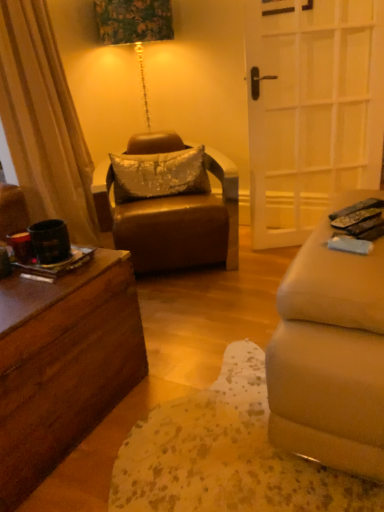
Locate an element on the screen. The width and height of the screenshot is (384, 512). white glass door at right is located at coordinates (311, 109).

You are a GUI agent. You are given a task and a screenshot of the screen. Output one action in this format:
    pyautogui.click(x=<x>, y=<y>)
    Task: Click on the black plastic remote control at lower right
    
    Given the screenshot: What is the action you would take?
    pyautogui.click(x=358, y=208)

How many degrees apart are the facing directions of white glass door at right and silver sequined pillow at center?

The angular difference between white glass door at right and silver sequined pillow at center is 3.21 degrees.

Is white glass door at right at the right side of silver sequined pillow at center?

Correct, you'll find white glass door at right to the right of silver sequined pillow at center.

Is white glass door at right oriented away from silver sequined pillow at center?

No, silver sequined pillow at center is not at the back of white glass door at right.

Considering the relative sizes of white glass door at right and silver sequined pillow at center in the image provided, is white glass door at right smaller than silver sequined pillow at center?

Actually, white glass door at right might be larger than silver sequined pillow at center.

Is white glass door at right at the back of black plastic remote control at lower right?

No, black plastic remote control at lower right is not facing the opposite direction of white glass door at right.

Is black plastic remote control at lower right completely or partially outside of white glass door at right?

Yes, black plastic remote control at lower right is located beyond the bounds of white glass door at right.

Find the location of a particular element. The width and height of the screenshot is (384, 512). remote control beneath the white glass door at right (from a real-world perspective) is located at coordinates (358, 208).

Is black plastic remote control at lower right positioned in front of white glass door at right?

Yes, it is in front of white glass door at right.

From the image's perspective, is black plastic remote control at lower right positioned above or below leather at center?

black plastic remote control at lower right is situated lower than leather at center in the image.

Choose the correct answer: Is black plastic remote control at lower right inside leather at center or outside it?

black plastic remote control at lower right cannot be found inside leather at center.

From a real-world perspective, between black plastic remote control at lower right and leather at center, who is vertically higher?

In real-world perspective, black plastic remote control at lower right is above.

From the picture: Considering the relative positions of black plastic remote control at lower right and leather at center in the image provided, is black plastic remote control at lower right to the right of leather at center from the viewer's perspective?

Yes.

Does point (162, 182) come closer to viewer compared to point (353, 128)?

Yes, point (162, 182) is in front of point (353, 128).

Does silver sequined pillow at center appear on the left side of white glass door at right?

Yes, silver sequined pillow at center is to the left of white glass door at right.

Is silver sequined pillow at center positioned before white glass door at right?

No, it is not.

Is silver sequined pillow at center shorter than white glass door at right?

Yes, silver sequined pillow at center is shorter than white glass door at right.

Is point (109, 194) farther from viewer compared to point (270, 118)?

Yes.

Is leather at center not near white glass door at right?

They are positioned close to each other.

Is leather at center positioned beyond the bounds of white glass door at right?

Absolutely, leather at center is external to white glass door at right.

Which object is closer to the camera taking this photo, leather at center or white glass door at right?

leather at center is in front.

From the image's perspective, is leather at center located beneath black plastic remote control at lower right?

No, from the image's perspective, leather at center is not below black plastic remote control at lower right.

Based on the photo, in terms of width, does leather at center look wider or thinner when compared to black plastic remote control at lower right?

leather at center is wider than black plastic remote control at lower right.

Considering the points (175, 199) and (370, 200), which point is in front, point (175, 199) or point (370, 200)?

Point (370, 200)

Considering the relative sizes of silver sequined pillow at center and leather at center in the image provided, is silver sequined pillow at center bigger than leather at center?

No.

Which object is further away from the camera, silver sequined pillow at center or leather at center?

Positioned behind is silver sequined pillow at center.

Which object is positioned more to the left, silver sequined pillow at center or leather at center?

silver sequined pillow at center.

Is silver sequined pillow at center looking in the opposite direction of leather at center?

Yes, silver sequined pillow at center is positioned with its back facing leather at center.

Where is `door above the silver sequined pillow at center (from the image's perspective)`? door above the silver sequined pillow at center (from the image's perspective) is located at coordinates (311, 109).

Image resolution: width=384 pixels, height=512 pixels. In order to click on door above the black plastic remote control at lower right (from a real-world perspective) in this screenshot , I will do point(311,109).

Estimate the real-world distances between objects in this image. Which object is closer to leather at center, silver sequined pillow at center or white glass door at right?

silver sequined pillow at center is closer to leather at center.

From the image, which object appears to be nearer to silver sequined pillow at center, white glass door at right or black plastic remote control at lower right?

Among the two, white glass door at right is located nearer to silver sequined pillow at center.

Consider the image. When comparing their distances from white glass door at right, does silver sequined pillow at center or leather at center seem closer?

leather at center lies closer to white glass door at right than the other object.

Considering their positions, is black plastic remote control at lower right positioned further to silver sequined pillow at center than white glass door at right?

black plastic remote control at lower right is positioned further to the anchor silver sequined pillow at center.

From the picture: Based on their spatial positions, is white glass door at right or leather at center further from black plastic remote control at lower right?

Among the two, white glass door at right is located further to black plastic remote control at lower right.

Based on the photo, which object lies nearer to the anchor point leather at center, silver sequined pillow at center or black plastic remote control at lower right?

silver sequined pillow at center lies closer to leather at center than the other object.

When comparing their distances from black plastic remote control at lower right, does silver sequined pillow at center or white glass door at right seem further?

silver sequined pillow at center is positioned further to the anchor black plastic remote control at lower right.

Which object lies nearer to the anchor point leather at center, black plastic remote control at lower right or silver sequined pillow at center?

silver sequined pillow at center is closer to leather at center.

This screenshot has width=384, height=512. Find the location of `remote control between leather at center and white glass door at right from left to right`. remote control between leather at center and white glass door at right from left to right is located at coordinates (358, 208).

At what (x,y) coordinates should I click in order to perform the action: click on remote control located between silver sequined pillow at center and white glass door at right in the left-right direction. Please return your answer as a coordinate pair (x, y). Image resolution: width=384 pixels, height=512 pixels. Looking at the image, I should click on (358, 208).

The image size is (384, 512). In order to click on chair between black plastic remote control at lower right and silver sequined pillow at center along the z-axis in this screenshot , I will do `click(174, 222)`.

Locate an element on the screen. The width and height of the screenshot is (384, 512). chair between silver sequined pillow at center and white glass door at right is located at coordinates (174, 222).